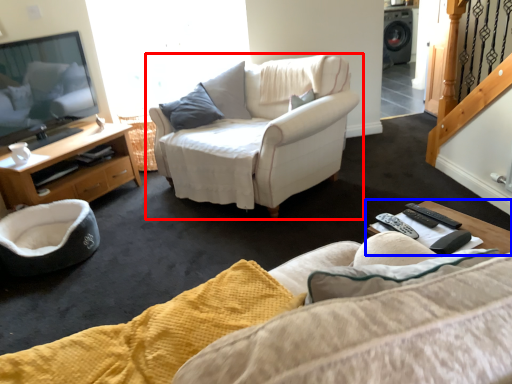
Question: Which object appears closest to the camera in this image, chair (highlighted by a red box) or coffee table (highlighted by a blue box)?

Choices:
 (A) chair
 (B) coffee table

Answer: (B)